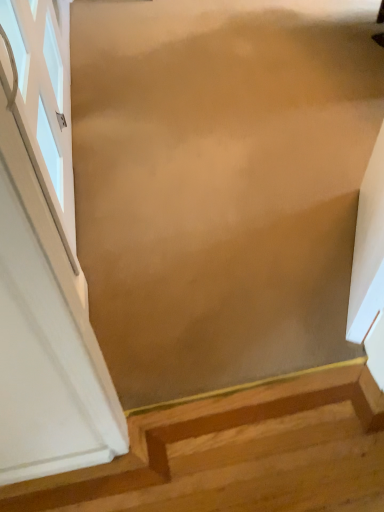
Question: Could wooden stairs at lower right be considered to be inside white glass window at left?

Choices:
 (A) yes
 (B) no

Answer: (B)

Question: From a real-world perspective, is white glass window at left physically below wooden stairs at lower right?

Choices:
 (A) no
 (B) yes

Answer: (A)

Question: Can you confirm if white glass window at left is thinner than wooden stairs at lower right?

Choices:
 (A) no
 (B) yes

Answer: (B)

Question: Is white glass window at left closer to the viewer compared to wooden stairs at lower right?

Choices:
 (A) yes
 (B) no

Answer: (B)

Question: Does white glass window at left appear on the left side of wooden stairs at lower right?

Choices:
 (A) yes
 (B) no

Answer: (A)

Question: From the image's perspective, would you say white glass window at left is shown under wooden stairs at lower right?

Choices:
 (A) no
 (B) yes

Answer: (A)

Question: Considering the relative sizes of wooden stairs at lower right and white glass window at left in the image provided, is wooden stairs at lower right wider than white glass window at left?

Choices:
 (A) yes
 (B) no

Answer: (A)

Question: From a real-world perspective, is wooden stairs at lower right on top of white glass window at left?

Choices:
 (A) no
 (B) yes

Answer: (A)

Question: Can you confirm if wooden stairs at lower right is shorter than white glass window at left?

Choices:
 (A) yes
 (B) no

Answer: (A)

Question: Is wooden stairs at lower right positioned in front of white glass window at left?

Choices:
 (A) no
 (B) yes

Answer: (B)

Question: From the image's perspective, is wooden stairs at lower right on top of white glass window at left?

Choices:
 (A) no
 (B) yes

Answer: (A)

Question: Can you confirm if wooden stairs at lower right is positioned to the left of white glass window at left?

Choices:
 (A) yes
 (B) no

Answer: (B)

Question: Would you say wooden stairs at lower right is to the left or to the right of white glass window at left in the picture?

Choices:
 (A) left
 (B) right

Answer: (B)